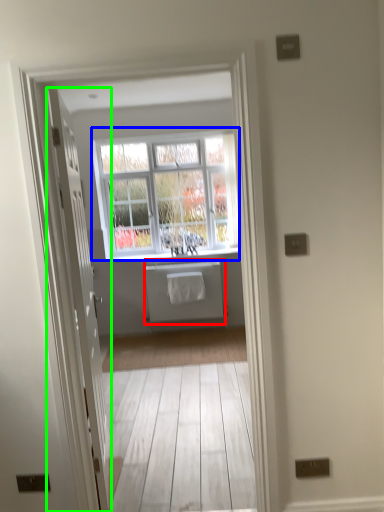
Question: Which is nearer to the appliance (highlighted by a red box)? window (highlighted by a blue box) or door (highlighted by a green box).

Choices:
 (A) window
 (B) door

Answer: (A)